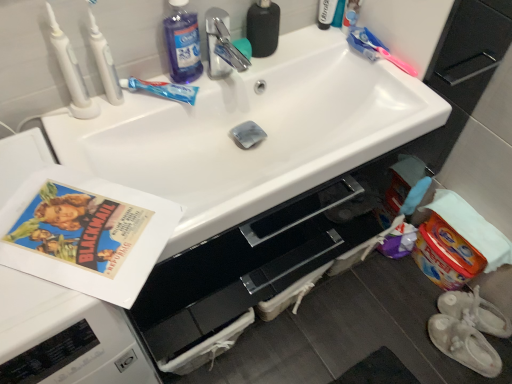
This screenshot has width=512, height=384. Find the location of `vacant area that is in front of white plastic tube at upper right`. vacant area that is in front of white plastic tube at upper right is located at coordinates (322, 51).